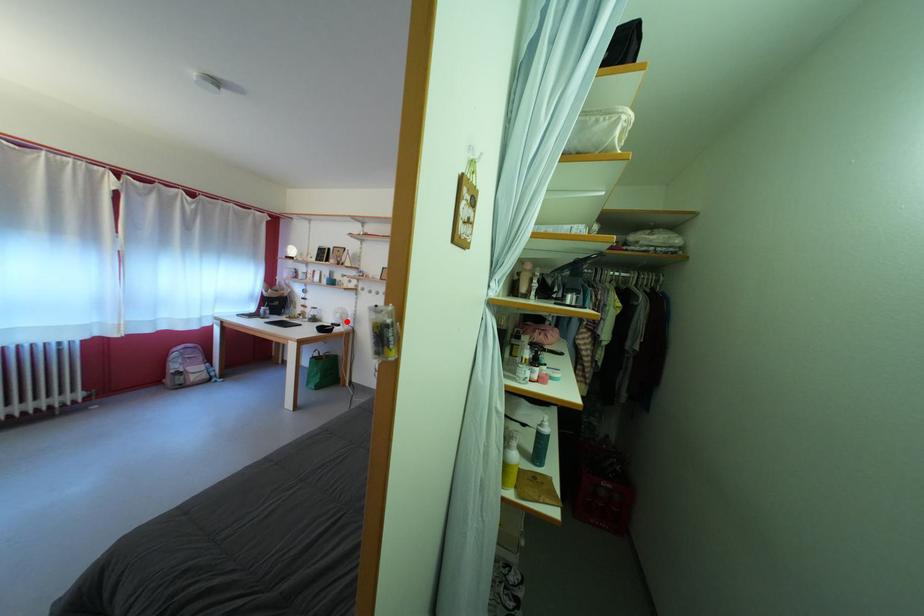
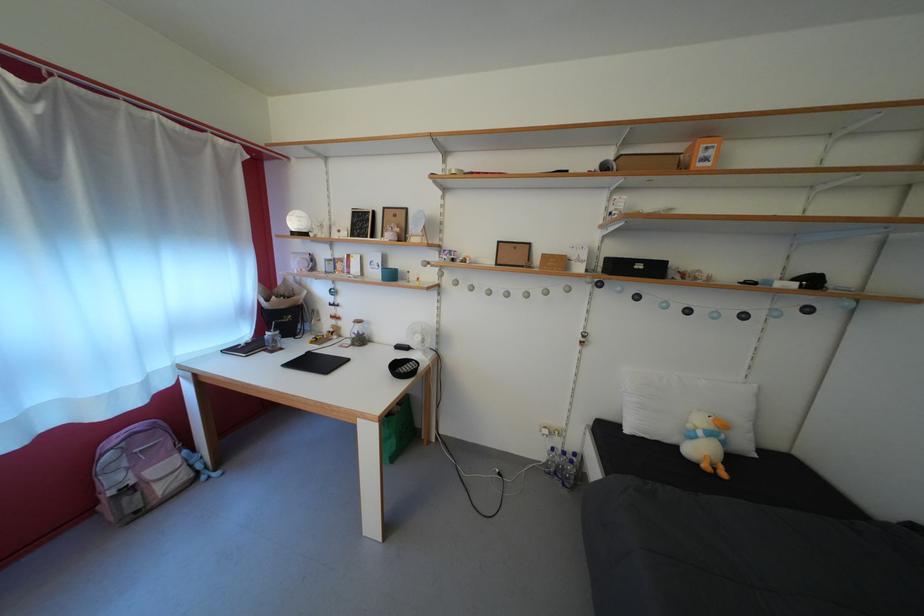
Locate, in the second image, the point that corresponds to the highlighted location in the first image.

(427, 344)